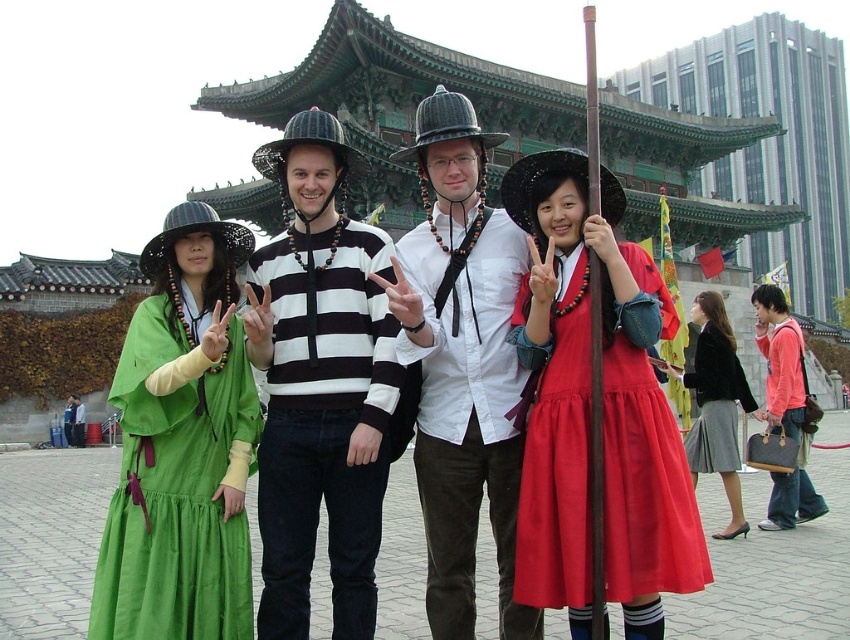
You are standing in the traditional Korean setting and see the group of four individuals. There is a point at coordinates (588,410). What object is located at this point?

The point at coordinates (588,410) corresponds to the matte red dress at center.

You are a photographer trying to adjust the lighting for a photo of the striped sweater at center and the matte black dress at center. Which object is positioned higher in the image?

The striped sweater at center is located above the matte black dress at center, so it is positioned higher in the image.